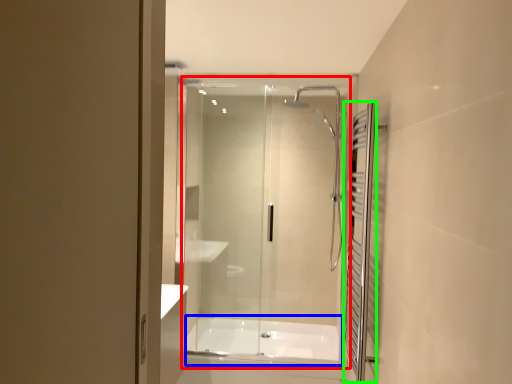
Question: Estimate the real-world distances between objects in this image. Which object is farther from glass door (highlighted by a red box), bath (highlighted by a blue box) or shower curtain (highlighted by a green box)?

Choices:
 (A) bath
 (B) shower curtain

Answer: (B)